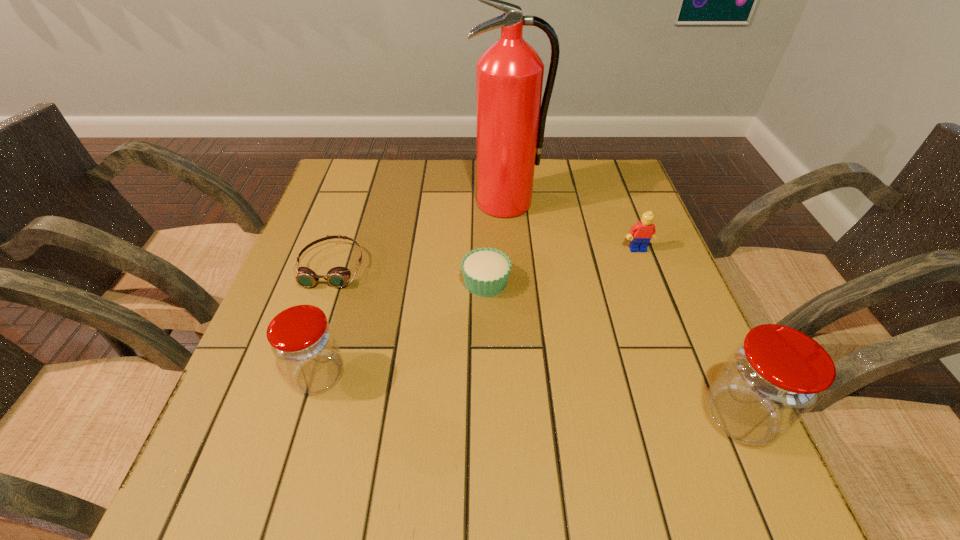
You are a GUI agent. You are given a task and a screenshot of the screen. Output one action in this format:
    pyautogui.click(x=<x>, y=<y>)
    Task: Click on the object located at the near left corner
    This screenshot has width=960, height=540.
    Given the screenshot: What is the action you would take?
    pyautogui.click(x=302, y=340)

In order to click on object that is at the near right corner in this screenshot , I will do `click(772, 379)`.

Locate an element on the screen. The width and height of the screenshot is (960, 540). vacant region at the far edge of the desktop is located at coordinates (555, 180).

In the image, there is a desktop. Identify the location of free space at the left edge. (307, 241).

In the image, there is a desktop. At what (x,y) coordinates should I click in order to perform the action: click on free space at the right edge. Please return your answer as a coordinate pair (x, y). This screenshot has height=540, width=960. Looking at the image, I should click on (677, 393).

Identify the location of vacant space at the far left corner of the desktop. The width and height of the screenshot is (960, 540). (367, 160).

Where is `vacant region at the near left corner of the desktop`? vacant region at the near left corner of the desktop is located at coordinates (262, 435).

This screenshot has width=960, height=540. I want to click on free space at the far right corner, so click(616, 160).

Find the location of a particular element. The image size is (960, 540). free space between the third tallest object and the taller jar is located at coordinates (529, 396).

I want to click on free spot between the second shortest object and the Lego, so click(562, 266).